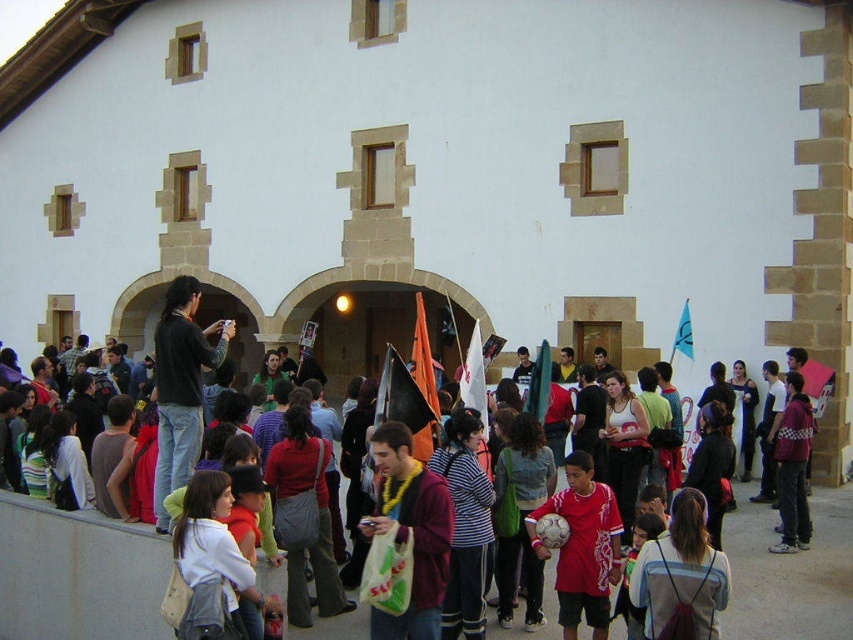
Question: Among these points, which one is farthest from the camera?

Choices:
 (A) (199, 372)
 (B) (607, 634)
 (C) (535, 396)

Answer: (C)

Question: Which of the following is the closest to the observer?

Choices:
 (A) (788, 406)
 (B) (7, 618)
 (C) (167, 292)

Answer: (B)

Question: Is dark gray sweater at center in front of checkered fabric jacket at lower right?

Choices:
 (A) yes
 (B) no

Answer: (A)

Question: Does red shirt at center have a larger size compared to white fabric flag at center?

Choices:
 (A) yes
 (B) no

Answer: (A)

Question: Which point is farther from the camera taking this photo?

Choices:
 (A) (686, 307)
 (B) (532, 392)

Answer: (A)

Question: Does dark gray sweater at center have a larger size compared to green fabric flag at center?

Choices:
 (A) no
 (B) yes

Answer: (B)